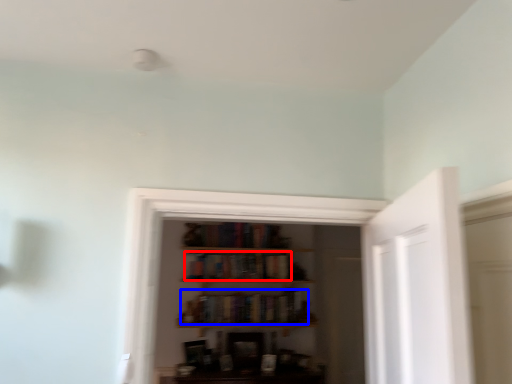
Question: Among these objects, which one is farthest to the camera, book (highlighted by a red box) or book (highlighted by a blue box)?

Choices:
 (A) book
 (B) book

Answer: (A)